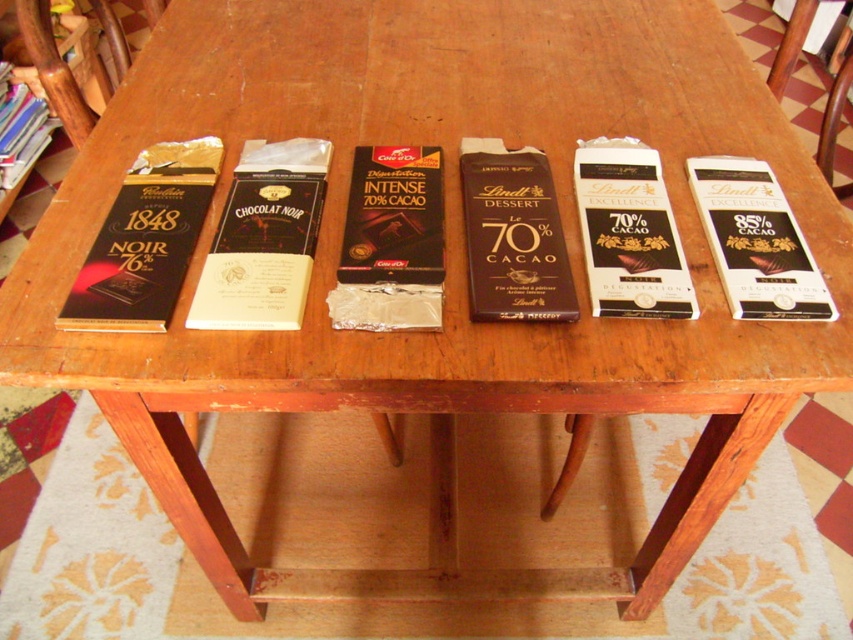
Question: Which point appears closest to the camera in this image?

Choices:
 (A) (86, 292)
 (B) (502, 168)

Answer: (A)

Question: Is matte white chocolate bar at center thinner than matte black lindt excellence chocolate bar at center?

Choices:
 (A) yes
 (B) no

Answer: (B)

Question: Estimate the real-world distances between objects in this image. Which object is farther from the matte black chocolate bar at left?

Choices:
 (A) matte white chocolate bar at center
 (B) dark brown chocolate bar at center
 (C) white glossy lindt excellence chocolate bar at right
 (D) matte black lindt excellence chocolate bar at center

Answer: (C)

Question: In this image, where is matte white chocolate bar at center located relative to dark brown chocolate bar at center?

Choices:
 (A) below
 (B) above

Answer: (B)

Question: Which of the following is the farthest from the observer?

Choices:
 (A) matte white chocolate bar at center
 (B) matte black chocolate bar at left

Answer: (A)

Question: Can you confirm if matte white chocolate bar at center is positioned to the left of white glossy lindt excellence chocolate bar at right?

Choices:
 (A) yes
 (B) no

Answer: (A)